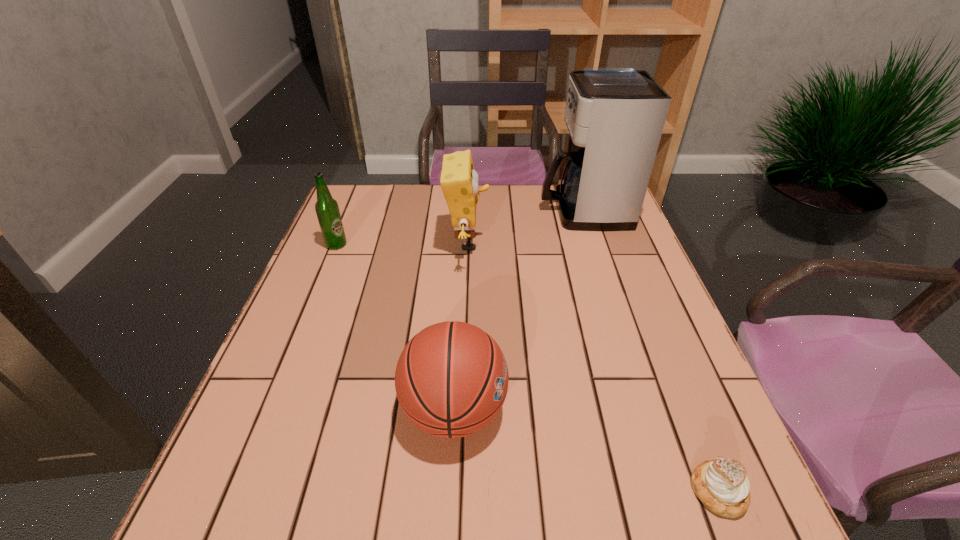
This screenshot has height=540, width=960. In order to click on free space between the coffee maker and the basketball in this screenshot , I will do `click(518, 310)`.

The height and width of the screenshot is (540, 960). Find the location of `empty location between the nearest object and the tallest object`. empty location between the nearest object and the tallest object is located at coordinates (651, 352).

Identify which object is the closest to the nearest object. Please provide its 2D coordinates. Your answer should be formatted as a tuple, i.e. [(x, y)], where the tuple contains the x and y coordinates of a point satisfying the conditions above.

[(451, 380)]

At what (x,y) coordinates should I click in order to perform the action: click on object that is the third closest to the basketball. Please return your answer as a coordinate pair (x, y). The height and width of the screenshot is (540, 960). Looking at the image, I should click on (327, 209).

Where is `vacant point that satisfies the following two spatial constraints: 1. on the back side of the pastry; 2. on the logo side of the basketball`? This screenshot has width=960, height=540. vacant point that satisfies the following two spatial constraints: 1. on the back side of the pastry; 2. on the logo side of the basketball is located at coordinates (685, 410).

I want to click on vacant space that satisfies the following two spatial constraints: 1. on the face of the shortest object; 2. on the left side of the sponge, so [458, 491].

Locate an element on the screen. free point that satisfies the following two spatial constraints: 1. on the logo side of the second nearest object; 2. on the back side of the pastry is located at coordinates [x=450, y=491].

Where is `free point that satisfies the following two spatial constraints: 1. on the face of the sponge; 2. on the back side of the nearest object`? free point that satisfies the following two spatial constraints: 1. on the face of the sponge; 2. on the back side of the nearest object is located at coordinates (458, 491).

Where is `vacant region that satisfies the following two spatial constraints: 1. on the front panel of the coffee maker; 2. on the back side of the shortest object`? vacant region that satisfies the following two spatial constraints: 1. on the front panel of the coffee maker; 2. on the back side of the shortest object is located at coordinates (674, 491).